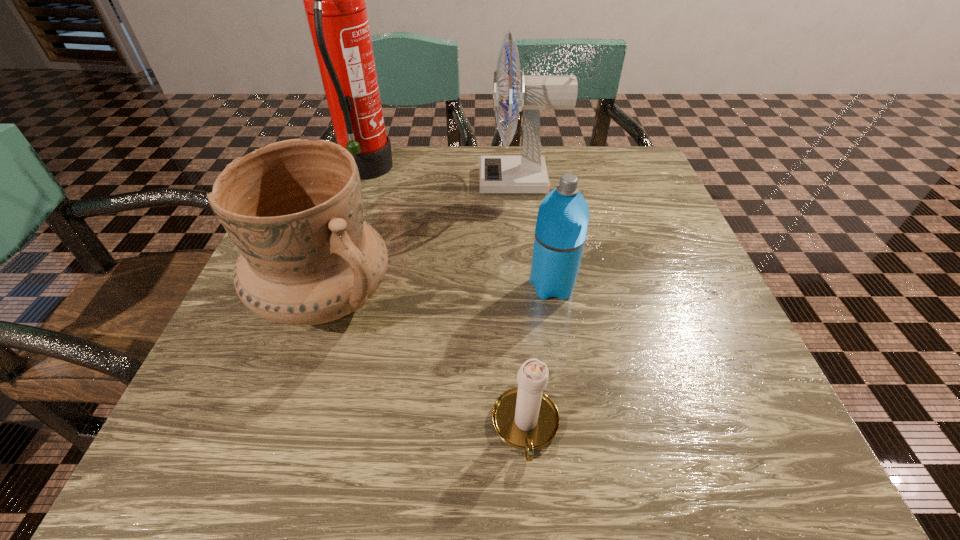
Find the location of `the tallest object`. the tallest object is located at coordinates (334, 0).

Locate an element on the screen. Image resolution: width=960 pixels, height=540 pixels. fan is located at coordinates (526, 174).

You are a GUI agent. You are given a task and a screenshot of the screen. Output one action in this format:
    pyautogui.click(x=<x>, y=<y>)
    Task: Click on the pottery
    
    Given the screenshot: What is the action you would take?
    pyautogui.click(x=294, y=209)

Find the location of a particular element. The width and height of the screenshot is (960, 540). thermos bottle is located at coordinates point(563,216).

Find the location of a particular element. the nearest object is located at coordinates (524, 417).

I want to click on candle holder, so click(524, 417).

This screenshot has height=540, width=960. I want to click on free location located 0.280m on the front-facing side of the fire extinguisher, so click(508, 171).

In order to click on free space located 0.200m on the front-facing side of the fan in this screenshot , I will do `click(395, 181)`.

I want to click on vacant point located on the front-facing side of the fan, so click(331, 181).

Find the location of a particular element. This screenshot has width=960, height=540. vacant space located 0.130m on the front-facing side of the fan is located at coordinates (424, 181).